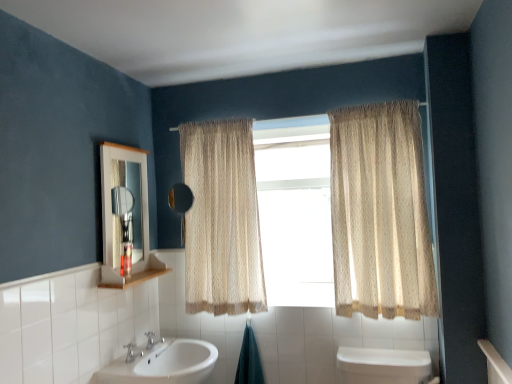
Question: Is there a large distance between beige sheer curtain at center, the 2th curtain from the right, and white glossy sink at lower center?

Choices:
 (A) yes
 (B) no

Answer: (B)

Question: Is white glossy sink at lower center surrounded by beige sheer curtain at center, the first curtain from the left?

Choices:
 (A) no
 (B) yes

Answer: (A)

Question: From a real-world perspective, is beige sheer curtain at center, the 2th curtain from the right, on top of white glossy sink at lower center?

Choices:
 (A) no
 (B) yes

Answer: (B)

Question: Can you confirm if beige sheer curtain at center, the 2th curtain from the right, is positioned to the right of white glossy sink at lower center?

Choices:
 (A) yes
 (B) no

Answer: (A)

Question: Is beige sheer curtain at center, the first curtain from the left, outside of white glossy sink at lower center?

Choices:
 (A) no
 (B) yes

Answer: (B)

Question: Is beige sheer curtain at center, the 2th curtain from the right, facing away from white glossy sink at lower center?

Choices:
 (A) no
 (B) yes

Answer: (A)

Question: Can you confirm if silver metallic faucet at lower center is shorter than white tile at left?

Choices:
 (A) yes
 (B) no

Answer: (A)

Question: Does silver metallic faucet at lower center have a greater height compared to white tile at left?

Choices:
 (A) no
 (B) yes

Answer: (A)

Question: Is silver metallic faucet at lower center behind white tile at left?

Choices:
 (A) yes
 (B) no

Answer: (A)

Question: Is silver metallic faucet at lower center not near white tile at left?

Choices:
 (A) yes
 (B) no

Answer: (A)

Question: From a real-world perspective, does silver metallic faucet at lower center sit lower than white tile at left?

Choices:
 (A) no
 (B) yes

Answer: (B)

Question: Does silver metallic faucet at lower center have a smaller size compared to white tile at left?

Choices:
 (A) no
 (B) yes

Answer: (B)

Question: From a real-world perspective, is white glossy sink at lower center on black matte mirror at center?

Choices:
 (A) no
 (B) yes

Answer: (A)